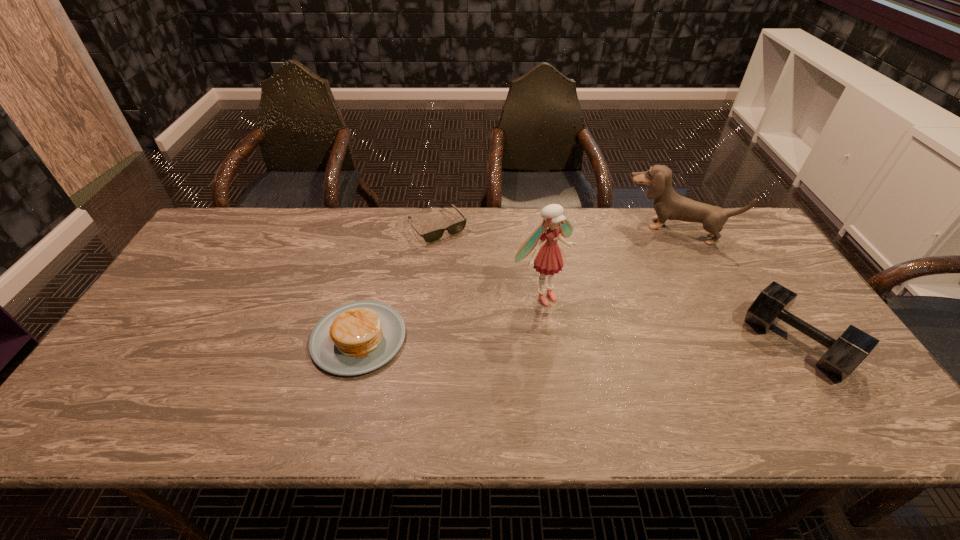
At what (x,y) coordinates should I click in order to perform the action: click on free space that satisfies the following two spatial constraints: 1. on the front side of the sunglasses; 2. on the right side of the dumbbell. Please return your answer as a coordinate pair (x, y). This screenshot has height=540, width=960. Looking at the image, I should click on (424, 343).